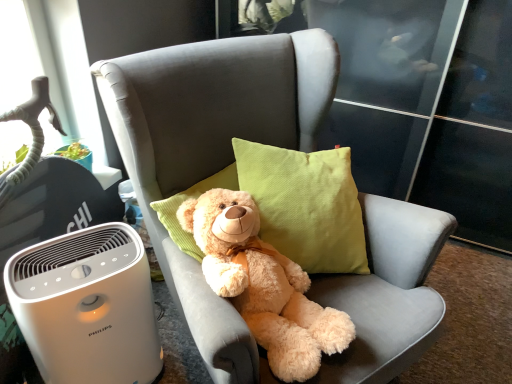
Question: Based on their positions, is soft gray fabric chair at center located to the left or right of fluffy beige teddy bear at center?

Choices:
 (A) right
 (B) left

Answer: (A)

Question: In terms of height, does soft gray fabric chair at center look taller or shorter compared to fluffy beige teddy bear at center?

Choices:
 (A) short
 (B) tall

Answer: (B)

Question: Considering the real-world distances, which object is farthest from the soft gray fabric chair at center?

Choices:
 (A) white plastic air purifier at lower left
 (B) fluffy beige teddy bear at center

Answer: (A)

Question: Estimate the real-world distances between objects in this image. Which object is farther from the white plastic air purifier at lower left?

Choices:
 (A) soft gray fabric chair at center
 (B) fluffy beige teddy bear at center

Answer: (B)